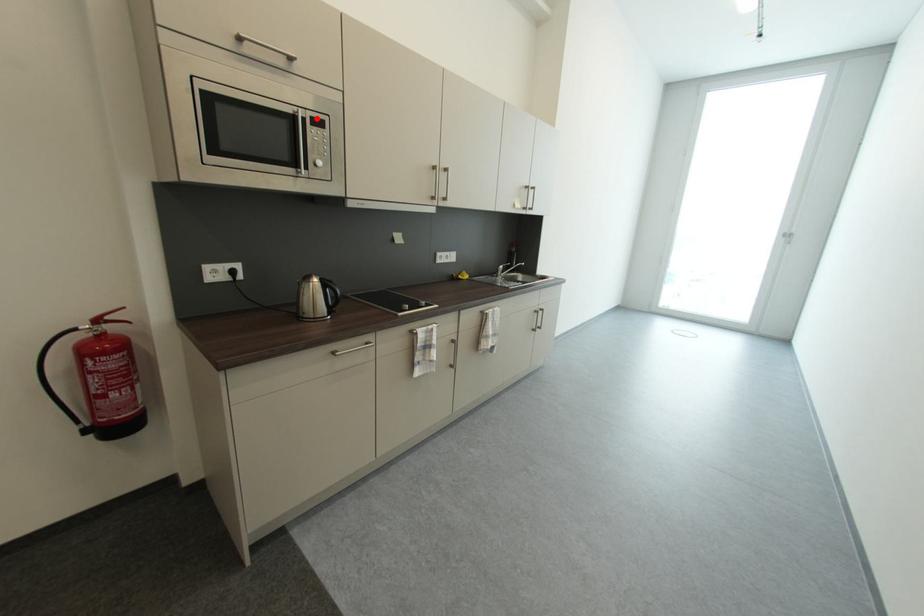
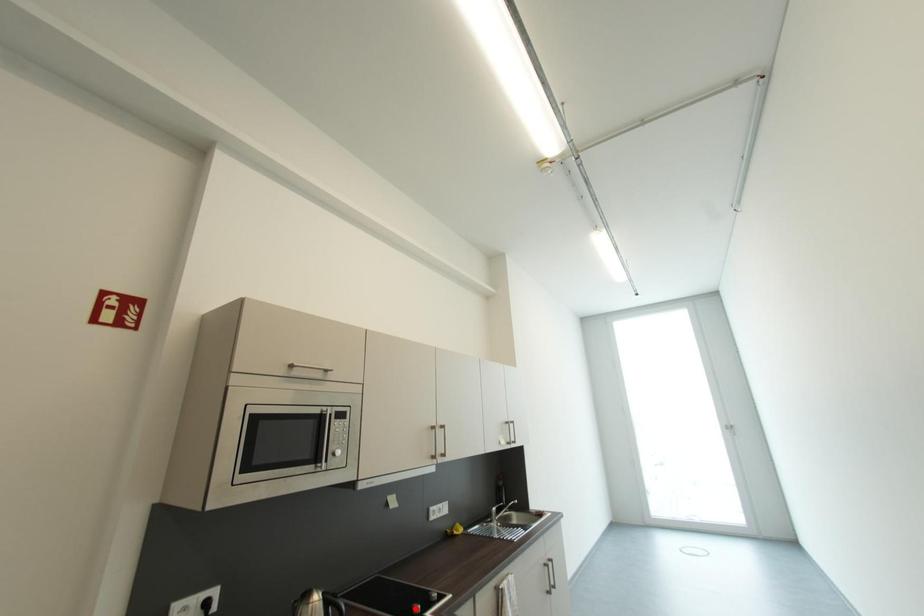
I am providing you with two images of the same scene from different viewpoints. A red point is marked on the first image and another point is marked on the second image. Does the point marked in image1 correspond to the same location as the one in image2?

No